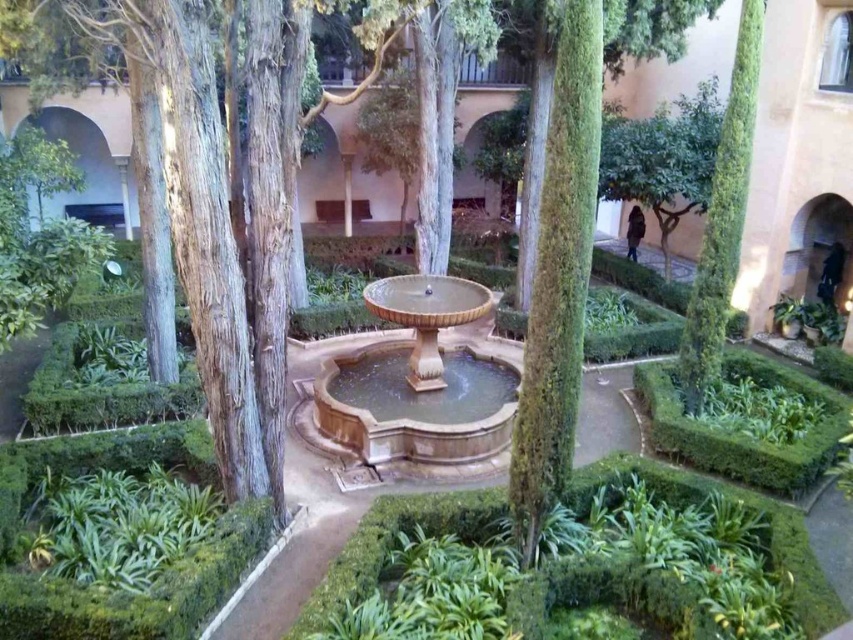
Describe the element at coordinates (418, 376) in the screenshot. I see `brown stone fountain at center` at that location.

Consider the image. Is brown stone fountain at center smaller than green leafy tree at right?

Incorrect, brown stone fountain at center is not smaller in size than green leafy tree at right.

Describe the element at coordinates (418, 376) in the screenshot. This screenshot has height=640, width=853. I see `brown stone fountain at center` at that location.

Where is `brown stone fountain at center`? brown stone fountain at center is located at coordinates (418, 376).